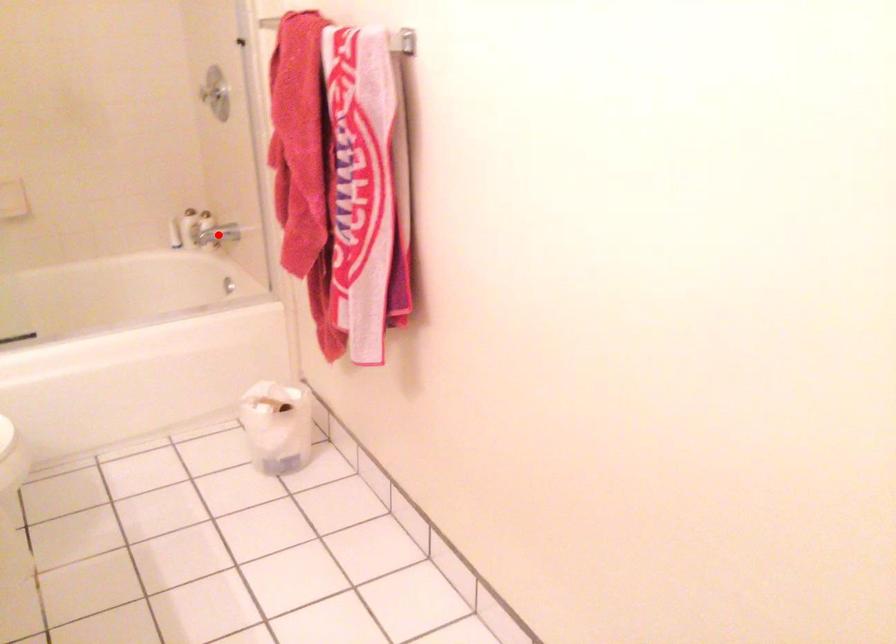
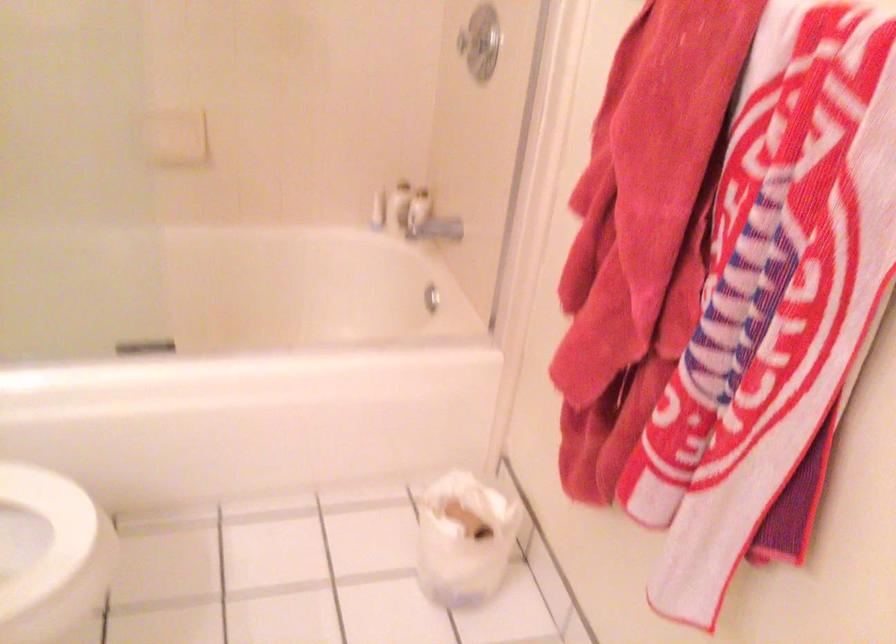
In the second image, find the point that corresponds to the highlighted location in the first image.

(429, 221)